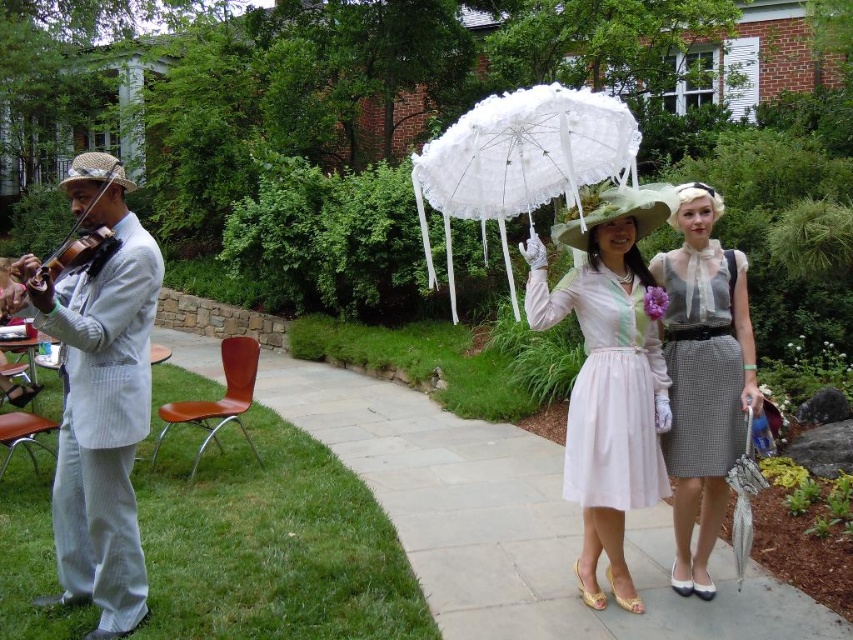
Question: Does checkered fabric dress at center appear on the left side of matte brown violin at left?

Choices:
 (A) yes
 (B) no

Answer: (B)

Question: Considering the real-world distances, which object is farthest from the matte brown violin at left?

Choices:
 (A) matte pink dress at center
 (B) checkered fabric dress at center
 (C) matte white dress at center
 (D) white lace umbrella at center

Answer: (B)

Question: Estimate the real-world distances between objects in this image. Which object is closer to the matte white dress at center?

Choices:
 (A) white lace umbrella at center
 (B) matte brown violin at left
 (C) light gray striped suit at left
 (D) matte pink dress at center

Answer: (D)

Question: Does checkered fabric dress at center appear over matte white dress at center?

Choices:
 (A) no
 (B) yes

Answer: (A)

Question: Does light gray striped suit at left lie in front of white sheer blouse at center?

Choices:
 (A) no
 (B) yes

Answer: (B)

Question: Which object is closer to the camera taking this photo?

Choices:
 (A) matte pink dress at center
 (B) checkered fabric dress at center
 (C) white lace umbrella at center

Answer: (C)